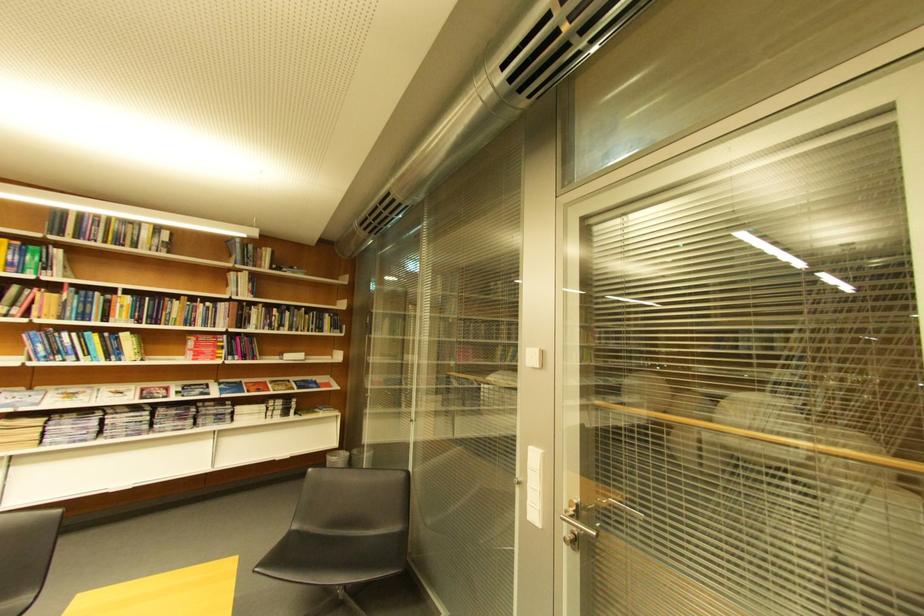
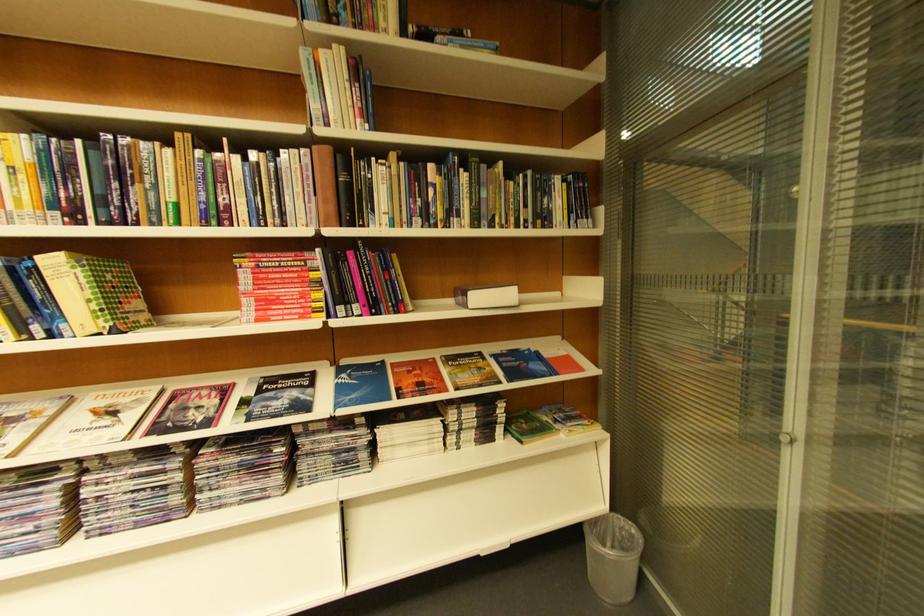
Locate, in the second image, the point that corresponds to pixel 213 339 in the first image.

(281, 262)